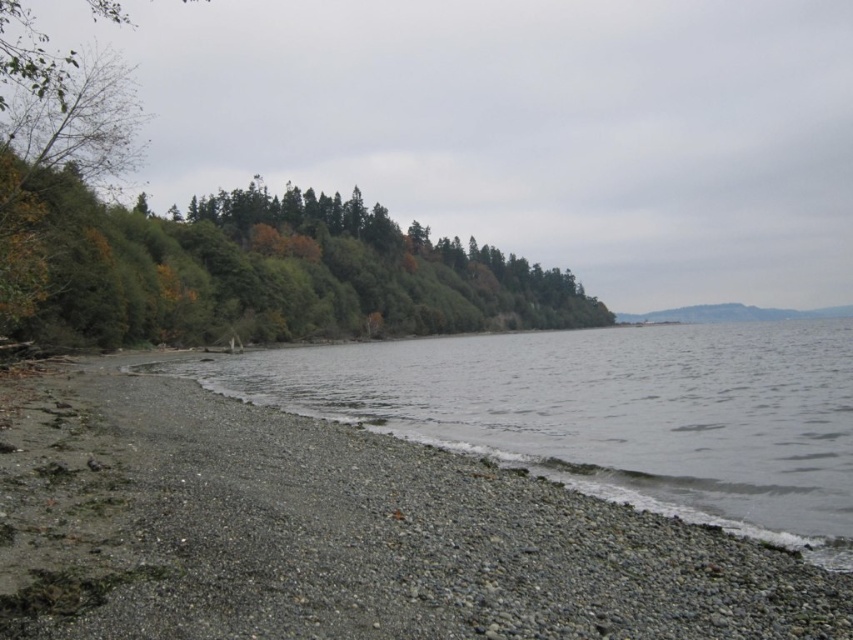
Question: Can you confirm if gray gravelly water at lower left is bigger than green matte trees at upper left?

Choices:
 (A) yes
 (B) no

Answer: (B)

Question: Which point is farther to the camera?

Choices:
 (A) gray gravelly water at lower left
 (B) green matte trees at upper left

Answer: (B)

Question: Which of the following is the closest to the observer?

Choices:
 (A) (73, 204)
 (B) (820, 428)

Answer: (B)

Question: In this image, where is gray gravelly water at lower left located relative to green matte trees at upper left?

Choices:
 (A) right
 (B) left

Answer: (A)

Question: Can you confirm if gray gravelly water at lower left is positioned above green matte trees at upper left?

Choices:
 (A) yes
 (B) no

Answer: (B)